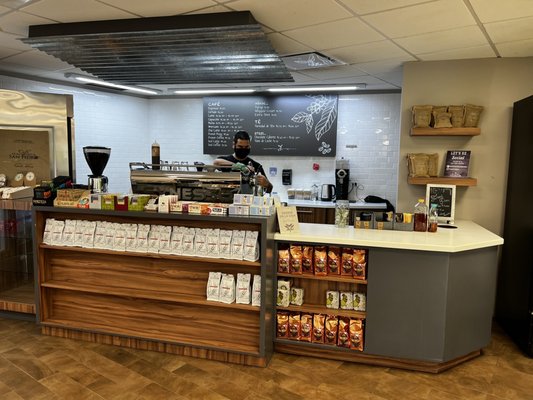
The height and width of the screenshot is (400, 533). What are the coordinates of `shelf` in the screenshot? It's located at (95, 301).